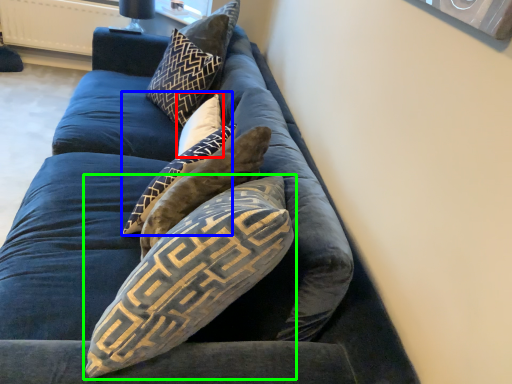
Question: Estimate the real-world distances between objects in this image. Which object is farther from pillow (highlighted by a red box), pillow (highlighted by a blue box) or pillow (highlighted by a green box)?

Choices:
 (A) pillow
 (B) pillow

Answer: (B)